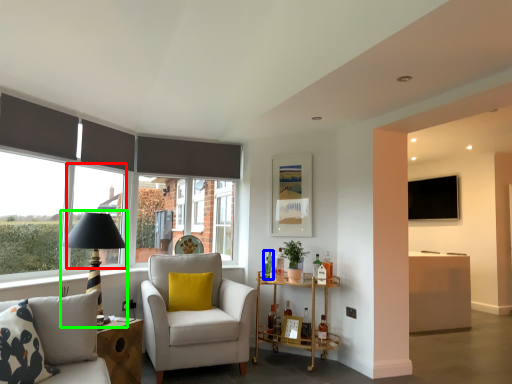
Question: Based on their relative distances, which object is nearer to window (highlighted by a red box)? Choose from bottle (highlighted by a blue box) and table lamp (highlighted by a green box).

Choices:
 (A) bottle
 (B) table lamp

Answer: (B)